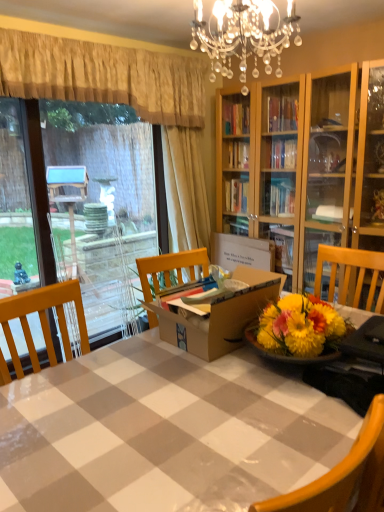
The image size is (384, 512). I want to click on free space in front of brown cardboard box at center, so click(192, 405).